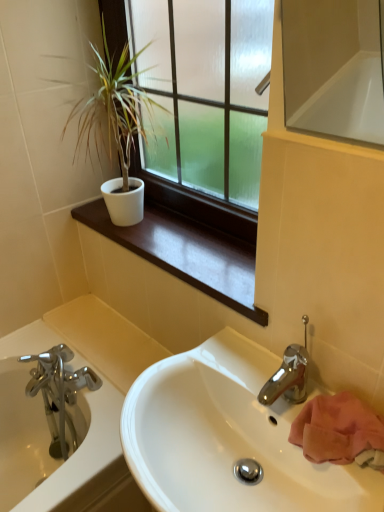
Find the location of `vacant space in white matte pot at upper left (from a real-world perspective)`. vacant space in white matte pot at upper left (from a real-world perspective) is located at coordinates pos(116,224).